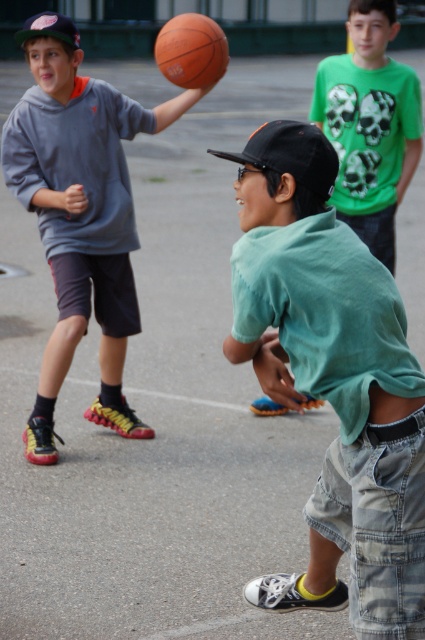
You are a photographer trying to capture a photo of the matte gray hoodie at upper left and the orange matte basketball at upper center. If you want to ensure both are in focus, which object should you focus on first?

The matte gray hoodie at upper left is larger in size compared to the orange matte basketball at upper center, so focusing on the matte gray hoodie at upper left first would ensure both are in focus.

You are a photographer trying to capture a wide shot of the basketball game. You notice the matte gray hoodie at upper left and the green matte shirt at center. Which of these two players should you adjust your camera angle to include more of, considering their sizes?

The matte gray hoodie at upper left is wider than the green matte shirt at center, so you should adjust your camera angle to include more of the matte gray hoodie at upper left.